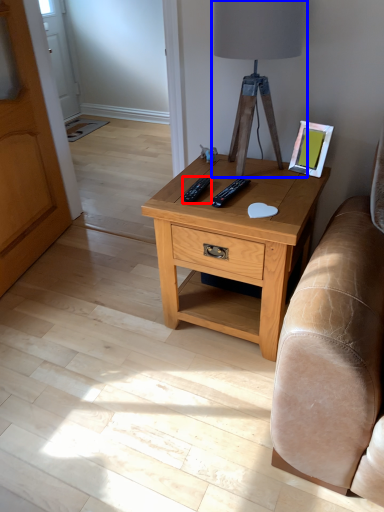
Question: Among these objects, which one is nearest to the camera, remote (highlighted by a red box) or table lamp (highlighted by a blue box)?

Choices:
 (A) remote
 (B) table lamp

Answer: (B)